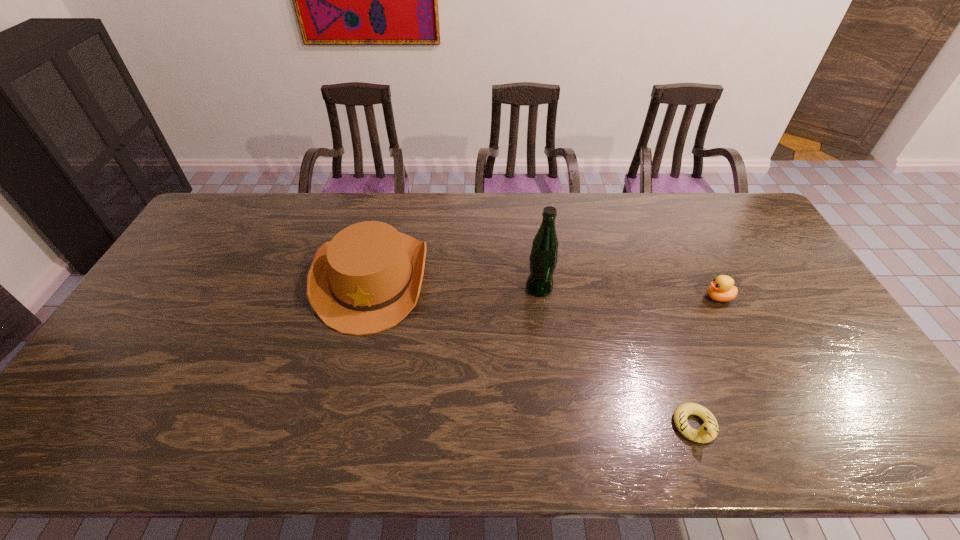
Find the location of a particular element. free spot located 0.170m on the face of the third tallest object is located at coordinates (647, 297).

This screenshot has width=960, height=540. I want to click on free point located 0.090m on the face of the third tallest object, so click(674, 297).

Where is `free region located on the face of the third tallest object`? free region located on the face of the third tallest object is located at coordinates (581, 297).

At what (x,y) coordinates should I click in order to perform the action: click on object present at the far edge. Please return your answer as a coordinate pair (x, y). This screenshot has width=960, height=540. Looking at the image, I should click on (367, 279).

You are a GUI agent. You are given a task and a screenshot of the screen. Output one action in this format:
    pyautogui.click(x=<x>, y=<y>)
    Task: Click on the object at the near edge
    Image resolution: width=960 pixels, height=540 pixels.
    Given the screenshot: What is the action you would take?
    pyautogui.click(x=708, y=431)

In the image, there is a desktop. At what (x,y) coordinates should I click in order to perform the action: click on vacant space at the far edge. Please return your answer as a coordinate pair (x, y). The width and height of the screenshot is (960, 540). Looking at the image, I should click on (444, 223).

Where is `vacant space at the near edge`? vacant space at the near edge is located at coordinates (357, 437).

In the image, there is a desktop. Identify the location of vacant space at the left edge. This screenshot has width=960, height=540. (132, 328).

At what (x,y) coordinates should I click in order to perform the action: click on vacant space at the right edge of the desktop. Please return your answer as a coordinate pair (x, y). This screenshot has height=540, width=960. Looking at the image, I should click on (782, 285).

Where is `vacant space at the far left corner of the desktop`? The image size is (960, 540). vacant space at the far left corner of the desktop is located at coordinates (210, 228).